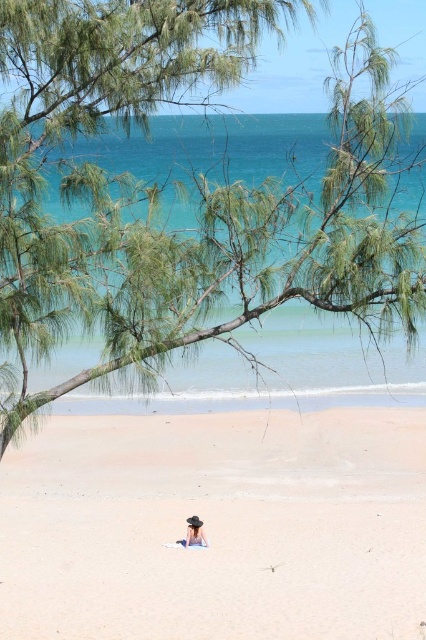
Between green leafy branch at upper center and matte blue dress at lower center, which one appears on the right side from the viewer's perspective?

green leafy branch at upper center

In the scene shown: Does green leafy branch at upper center appear on the right side of matte blue dress at lower center?

Yes, green leafy branch at upper center is to the right of matte blue dress at lower center.

Does point (120, 241) come closer to viewer compared to point (195, 525)?

Yes.

This screenshot has width=426, height=640. In order to click on green leafy branch at upper center in this screenshot , I will do `click(195, 193)`.

In the scene shown: Measure the distance between light beige sand at center and matte blue dress at lower center.

light beige sand at center is 2.58 meters away from matte blue dress at lower center.

Which is more to the left, light beige sand at center or matte blue dress at lower center?

matte blue dress at lower center

Looking at this image, measure the distance between point (x=141, y=461) and camera.

Point (x=141, y=461) and camera are 18.52 meters apart.

The height and width of the screenshot is (640, 426). I want to click on light beige sand at center, so click(216, 525).

Is point (80, 198) behind point (196, 451)?

No, it is in front of (196, 451).

Looking at this image, is green leafy branch at upper center shorter than light beige sand at center?

No.

Does point (377, 292) come farther from viewer compared to point (253, 582)?

No, (377, 292) is closer to viewer.

Where is `green leafy branch at upper center`? The width and height of the screenshot is (426, 640). green leafy branch at upper center is located at coordinates (195, 193).